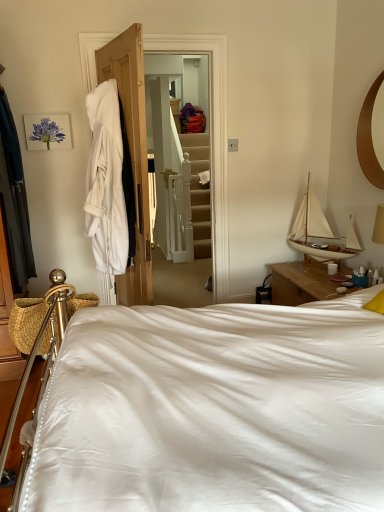
You are a GUI agent. You are given a task and a screenshot of the screen. Output one action in this format:
    pyautogui.click(x=<x>, y=<y>)
    Task: Click on the empty space that is ontop of white cloth at left (from a real-world perspective)
    Image resolution: width=384 pixels, height=512 pixels.
    Given the screenshot: What is the action you would take?
    pyautogui.click(x=174, y=32)